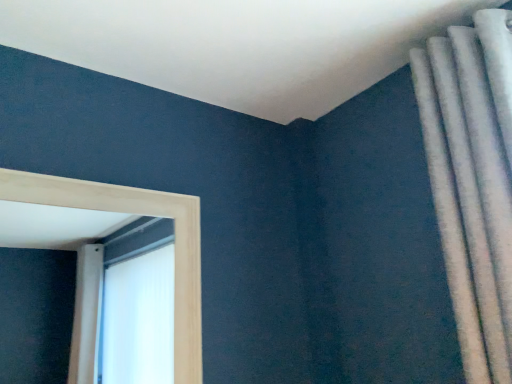
Image resolution: width=512 pixels, height=384 pixels. What do you see at coordinates (137, 214) in the screenshot?
I see `light wood frame at left` at bounding box center [137, 214].

Measure the distance between point (196, 334) and camera.

The distance of point (196, 334) from camera is 1.36 meters.

Find the location of a particular element. The height and width of the screenshot is (384, 512). light wood frame at left is located at coordinates (137, 214).

Describe the element at coordinates (473, 181) in the screenshot. I see `white textured curtain at upper right` at that location.

Measure the distance between white textured curtain at upper right and camera.

white textured curtain at upper right is 39.30 inches from camera.

You are a GUI agent. You are given a task and a screenshot of the screen. Output one action in this format:
    pyautogui.click(x=<x>, y=<y>)
    Task: Click on the white textured curtain at upper right
    The height and width of the screenshot is (384, 512).
    Given the screenshot: What is the action you would take?
    pyautogui.click(x=473, y=181)

Find the location of a particular element. This screenshot has height=384, width=512. light wood frame at left is located at coordinates (137, 214).

Visually, is light wood frame at left positioned to the left or to the right of white textured curtain at upper right?

light wood frame at left is to the left of white textured curtain at upper right.

From the picture: Is the position of light wood frame at left less distant than that of white textured curtain at upper right?

No, light wood frame at left is behind white textured curtain at upper right.

Considering the points (37, 203) and (431, 153), which point is behind, point (37, 203) or point (431, 153)?

Positioned behind is point (431, 153).

From the image's perspective, would you say light wood frame at left is shown under white textured curtain at upper right?

Correct, light wood frame at left appears lower than white textured curtain at upper right in the image.

From a real-world perspective, is light wood frame at left above or below white textured curtain at upper right?

light wood frame at left is below white textured curtain at upper right.

Is light wood frame at left thinner than white textured curtain at upper right?

Yes, light wood frame at left is thinner than white textured curtain at upper right.

Does light wood frame at left have a lesser height compared to white textured curtain at upper right?

Yes, light wood frame at left is shorter than white textured curtain at upper right.

Consider the image. Can you confirm if light wood frame at left is bigger than white textured curtain at upper right?

Actually, light wood frame at left might be smaller than white textured curtain at upper right.

Is white textured curtain at upper right completely or partially inside light wood frame at left?

No, white textured curtain at upper right is located outside of light wood frame at left.

Is light wood frame at left next to white textured curtain at upper right and touching it?

No.

Is light wood frame at left positioned with its back to white textured curtain at upper right?

light wood frame at left is not turned away from white textured curtain at upper right.

How different are the orientations of light wood frame at left and white textured curtain at upper right in degrees?

They differ by 90.2 degrees in their facing directions.

In the image, there is a white textured curtain at upper right. What are the coordinates of `window below it (from a real-world perspective)` in the screenshot? It's located at (137, 214).

From the picture: Does white textured curtain at upper right appear on the left side of light wood frame at left?

In fact, white textured curtain at upper right is to the right of light wood frame at left.

Which object is more forward, white textured curtain at upper right or light wood frame at left?

Positioned in front is white textured curtain at upper right.

Does point (479, 122) lie in front of point (193, 329)?

Yes, it is.

From the image's perspective, is white textured curtain at upper right on light wood frame at left?

Indeed, from the image's perspective, white textured curtain at upper right is shown above light wood frame at left.

From a real-world perspective, does white textured curtain at upper right sit lower than light wood frame at left?

No, from a real-world perspective, white textured curtain at upper right is not under light wood frame at left.

Consider the image. Considering the relative sizes of white textured curtain at upper right and light wood frame at left in the image provided, is white textured curtain at upper right thinner than light wood frame at left?

Incorrect, the width of white textured curtain at upper right is not less than that of light wood frame at left.

Considering the relative sizes of white textured curtain at upper right and light wood frame at left in the image provided, is white textured curtain at upper right taller than light wood frame at left?

Correct, white textured curtain at upper right is much taller as light wood frame at left.

Considering the sizes of objects white textured curtain at upper right and light wood frame at left in the image provided, who is bigger, white textured curtain at upper right or light wood frame at left?

white textured curtain at upper right.

Would you say white textured curtain at upper right is outside light wood frame at left?

Yes, white textured curtain at upper right is located beyond the bounds of light wood frame at left.

Would you consider white textured curtain at upper right to be distant from light wood frame at left?

No, there isn't a large distance between white textured curtain at upper right and light wood frame at left.

Is white textured curtain at upper right facing away from light wood frame at left?

No, white textured curtain at upper right is not facing away from light wood frame at left.

What's the angular difference between white textured curtain at upper right and light wood frame at left's facing directions?

There is a 90.2-degree angle between the facing directions of white textured curtain at upper right and light wood frame at left.

Identify the location of window that is behind the white textured curtain at upper right. The height and width of the screenshot is (384, 512). (137, 214).

The width and height of the screenshot is (512, 384). I want to click on window on the left of white textured curtain at upper right, so click(x=137, y=214).

What are the coordinates of `window below the white textured curtain at upper right (from a real-world perspective)` in the screenshot? It's located at (137, 214).